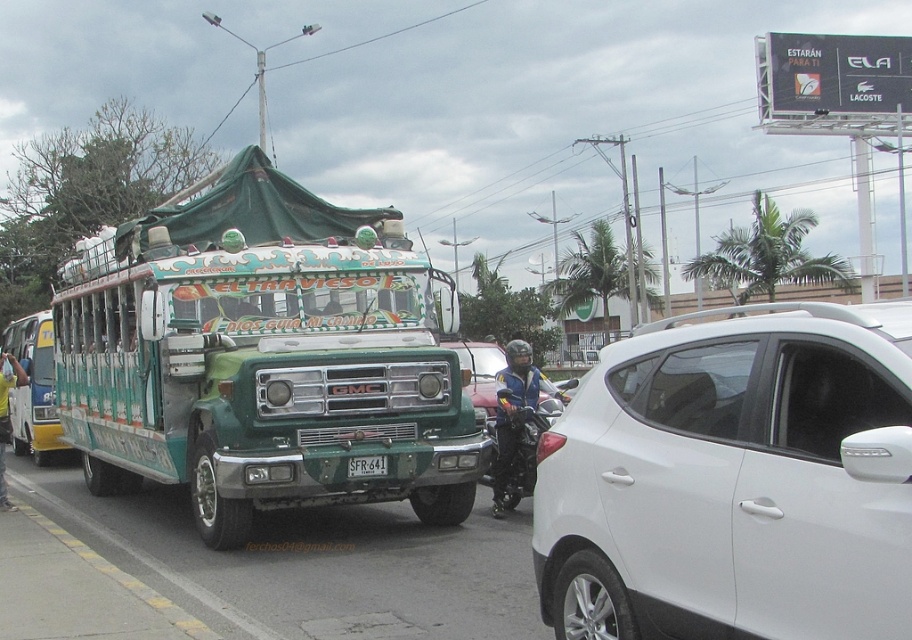
Question: Does green matte bus at center appear on the left side of white matte motorcycle at center?

Choices:
 (A) no
 (B) yes

Answer: (B)

Question: Which point is closer to the camera?

Choices:
 (A) green matte bus at center
 (B) white matte motorcycle at center
 (C) green matte bus at left

Answer: (A)

Question: Which point appears farthest from the camera in this image?

Choices:
 (A) (296, 499)
 (B) (0, 378)

Answer: (B)

Question: Considering the real-world distances, which object is farthest from the white matte motorcycle at center?

Choices:
 (A) blue leather jacket at center
 (B) white plastic license plate at center
 (C) green matte bus at center
 (D) green matte bus at left

Answer: (D)

Question: Is green matte bus at left further to camera compared to white plastic license plate at center?

Choices:
 (A) yes
 (B) no

Answer: (A)

Question: Can you confirm if green matte bus at center is positioned to the left of yellow fabric shirt at left?

Choices:
 (A) yes
 (B) no

Answer: (B)